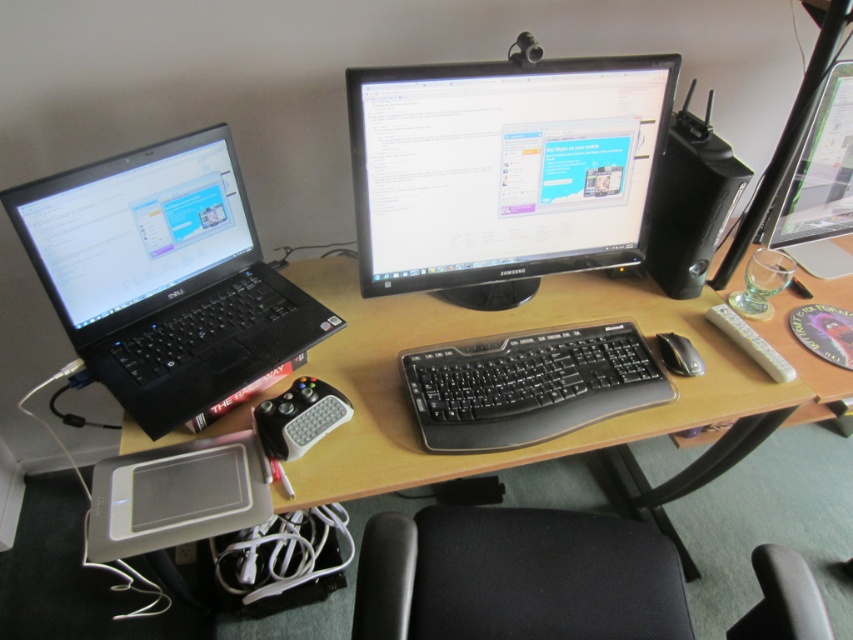
Question: Which point appears farthest from the camera in this image?

Choices:
 (A) (380, 634)
 (B) (213, 259)

Answer: (B)

Question: Which object appears closest to the camera in this image?

Choices:
 (A) black glossy monitor at center
 (B) black plastic mouse at right

Answer: (A)

Question: Is black plastic keyboard at center positioned behind matte black monitor at upper right?

Choices:
 (A) no
 (B) yes

Answer: (A)

Question: Among these objects, which one is farthest from the camera?

Choices:
 (A) black plastic speaker at right
 (B) black plastic keyboard at center
 (C) black plastic laptop at left

Answer: (A)

Question: Can you confirm if wooden desk at center is positioned above black plastic speaker at right?

Choices:
 (A) yes
 (B) no

Answer: (B)

Question: Does black glossy monitor at center appear under black plastic speaker at right?

Choices:
 (A) no
 (B) yes

Answer: (A)